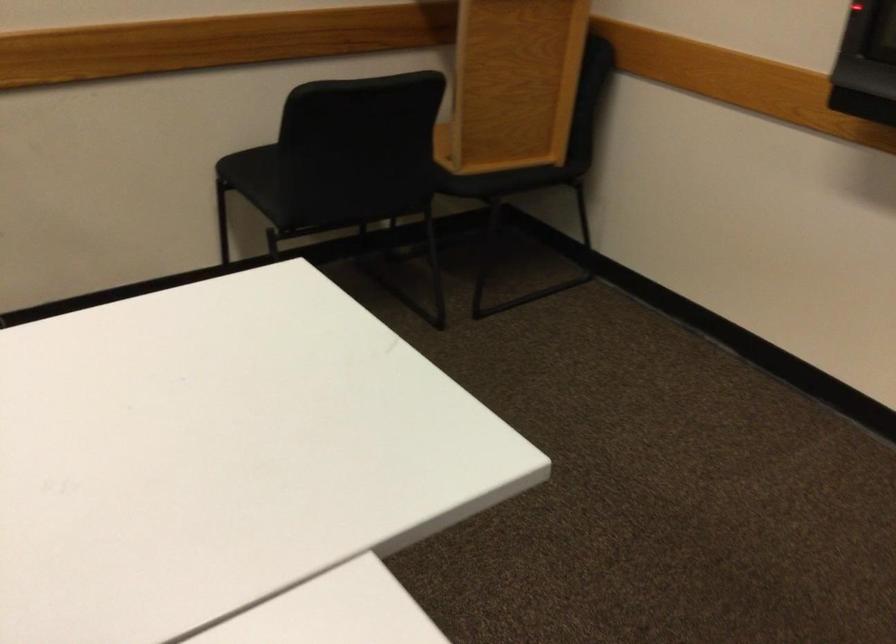
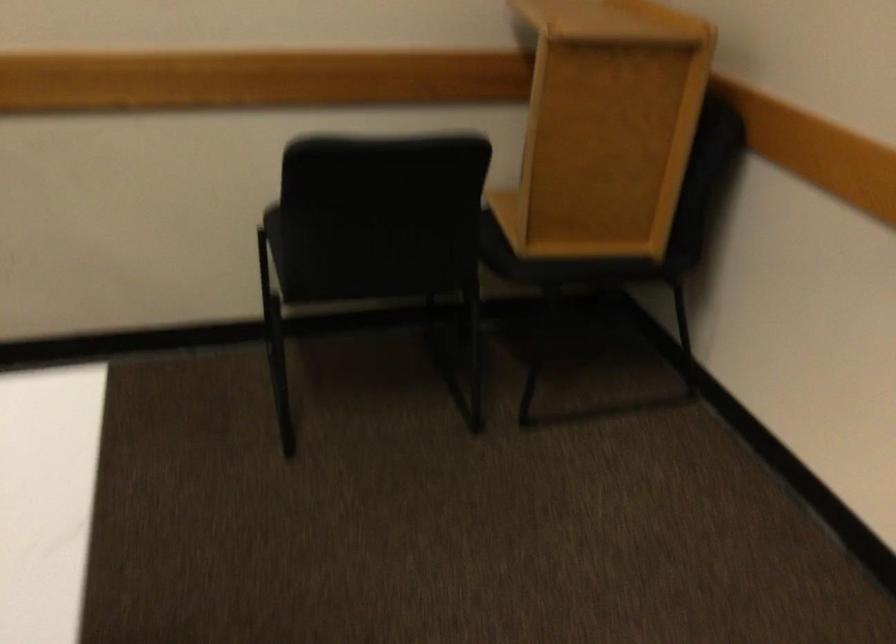
What movement of the cameraman would produce the second image?

The cameraman moved toward right, forward.